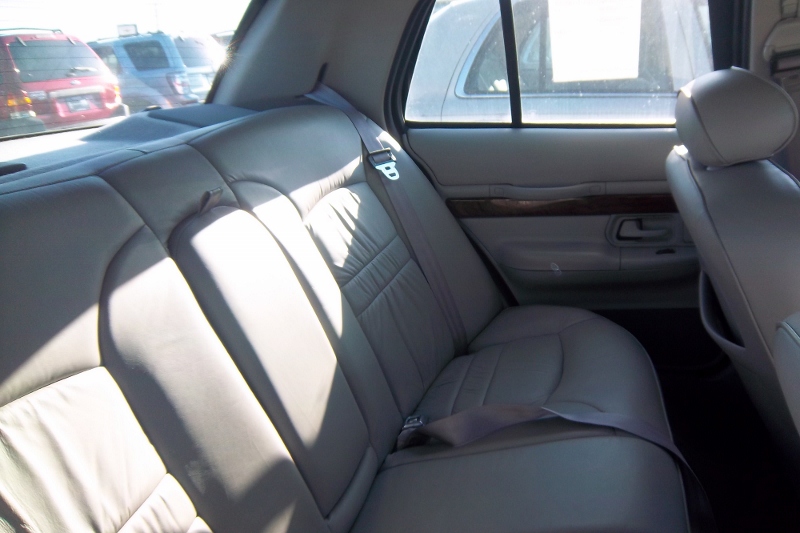
Image resolution: width=800 pixels, height=533 pixels. I want to click on handle, so click(629, 224).